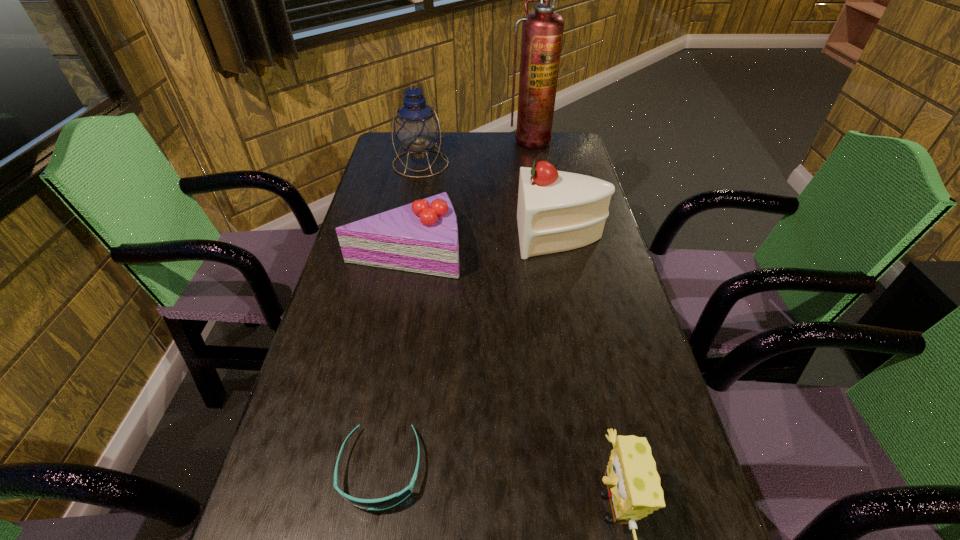
Identify which object is the fourth closest to the sponge. Please provide its 2D coordinates. Your answer should be formatted as a tuple, i.e. [(x, y)], where the tuple contains the x and y coordinates of a point satisfying the conditions above.

[(417, 128)]

You are a GUI agent. You are given a task and a screenshot of the screen. Output one action in this format:
    pyautogui.click(x=<x>, y=<y>)
    Task: Click on the vacant space that satisfies the following two spatial constraints: 1. on the front-facing side of the lantern; 2. on the right side of the shorter cake
    The width and height of the screenshot is (960, 540).
    Given the screenshot: What is the action you would take?
    pyautogui.click(x=404, y=251)

This screenshot has height=540, width=960. I want to click on free space that satisfies the following two spatial constraints: 1. on the side of the taller cake with the label; 2. on the right side of the fire extinguisher, so click(546, 237).

The width and height of the screenshot is (960, 540). I want to click on vacant space that satisfies the following two spatial constraints: 1. on the front-facing side of the lantern; 2. on the right side of the shorter cake, so click(x=404, y=251).